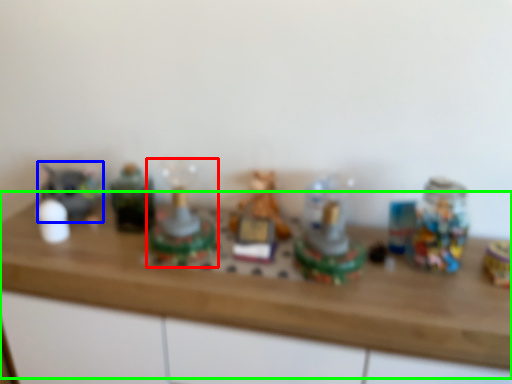
Question: Which object is the closest to the toy (highlighted by a red box)? Choose among these: toy (highlighted by a blue box) or counter top (highlighted by a green box).

Choices:
 (A) toy
 (B) counter top

Answer: (B)